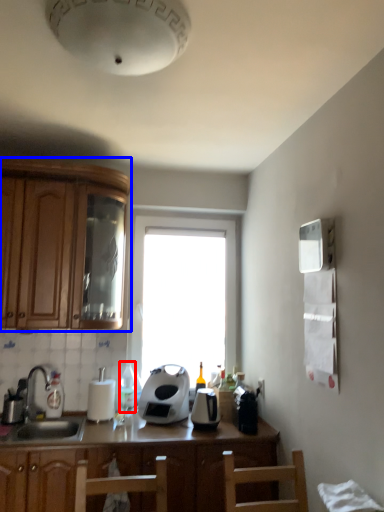
Question: Which object is closer to the camera taking this photo, bottle (highlighted by a red box) or cabinetry (highlighted by a blue box)?

Choices:
 (A) bottle
 (B) cabinetry

Answer: (B)